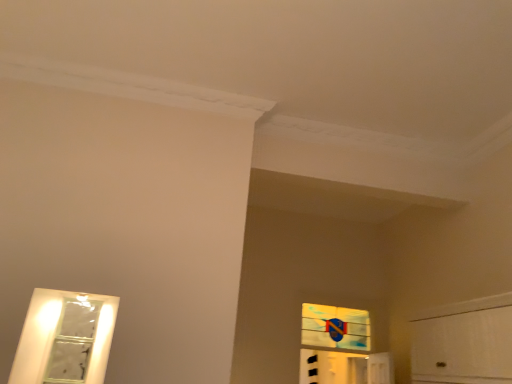
Question: Should I look upward or downward to see transparent plastic window at upper center?

Choices:
 (A) up
 (B) down

Answer: (B)